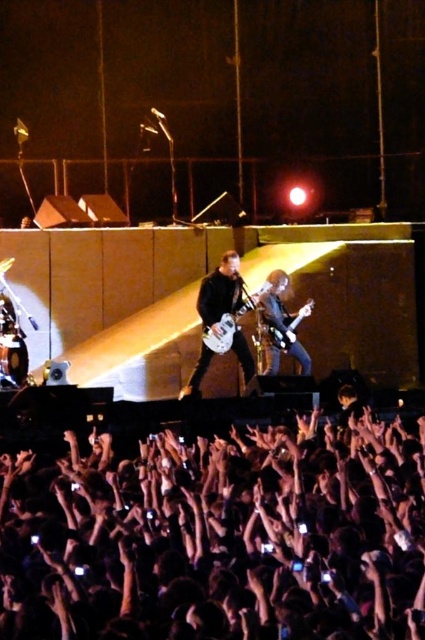
Does point (198, 388) come in front of point (291, 330)?

Yes, it is in front of point (291, 330).

Which of these two, shiny black guitar at center or shiny silver guitar at center, stands shorter?

With less height is shiny silver guitar at center.

Is point (192, 381) positioned before point (291, 333)?

Yes, point (192, 381) is closer to viewer.

Where is `shiny black guitar at center`? Image resolution: width=425 pixels, height=640 pixels. shiny black guitar at center is located at coordinates (223, 317).

Can you confirm if shiny silver guitar at center is positioned above matte black guitar at center?

Yes, shiny silver guitar at center is above matte black guitar at center.

This screenshot has width=425, height=640. What do you see at coordinates (280, 321) in the screenshot?
I see `shiny silver guitar at center` at bounding box center [280, 321].

Locate an element on the screen. The width and height of the screenshot is (425, 640). shiny silver guitar at center is located at coordinates (280, 321).

Is point (286, 328) positioned before point (226, 323)?

That is False.

Does shiny black guitar at center have a smaller size compared to matte black guitar at center?

No, shiny black guitar at center is not smaller than matte black guitar at center.

Is point (229, 305) positioned after point (221, 336)?

Yes, point (229, 305) is farther from viewer.

At what (x,y) coordinates should I click in order to perform the action: click on shiny black guitar at center. Please return your answer as a coordinate pair (x, y). The height and width of the screenshot is (640, 425). Looking at the image, I should click on (223, 317).